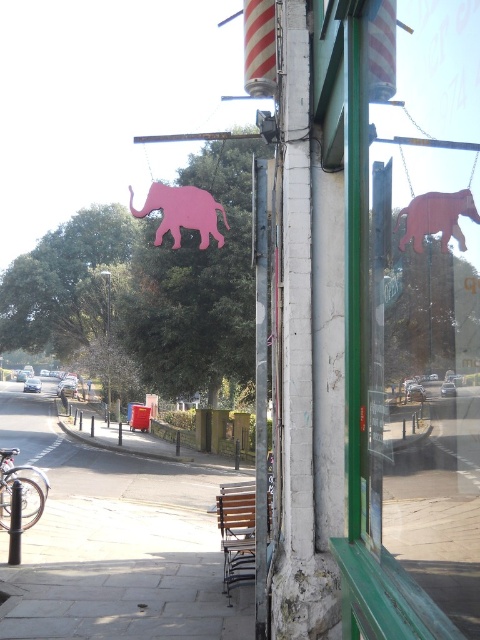
Question: Which point is closer to the camera?

Choices:
 (A) pink matte elephant at center
 (B) paved concrete sidewalk at lower left

Answer: (A)

Question: Is pink matte elephant at upper center further to the viewer compared to wooden elephant at upper right?

Choices:
 (A) yes
 (B) no

Answer: (A)

Question: Can you confirm if paved concrete sidewalk at lower left is positioned below wooden elephant at upper right?

Choices:
 (A) yes
 (B) no

Answer: (A)

Question: Among these objects, which one is nearest to the camera?

Choices:
 (A) wooden elephant at upper right
 (B) paved concrete sidewalk at lower left
 (C) pink matte elephant at upper center

Answer: (A)

Question: From the image, what is the correct spatial relationship of pink matte elephant at upper center in relation to wooden elephant at upper right?

Choices:
 (A) above
 (B) below

Answer: (A)

Question: Which of the following is the farthest from the observer?

Choices:
 (A) pink matte elephant at upper center
 (B) pink matte elephant at center

Answer: (A)